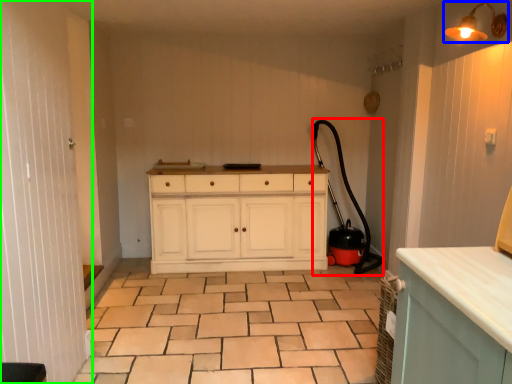
Question: Estimate the real-world distances between objects in this image. Which object is farther from garden hose (highlighted by a red box), light fixture (highlighted by a blue box) or screen door (highlighted by a green box)?

Choices:
 (A) light fixture
 (B) screen door

Answer: (B)